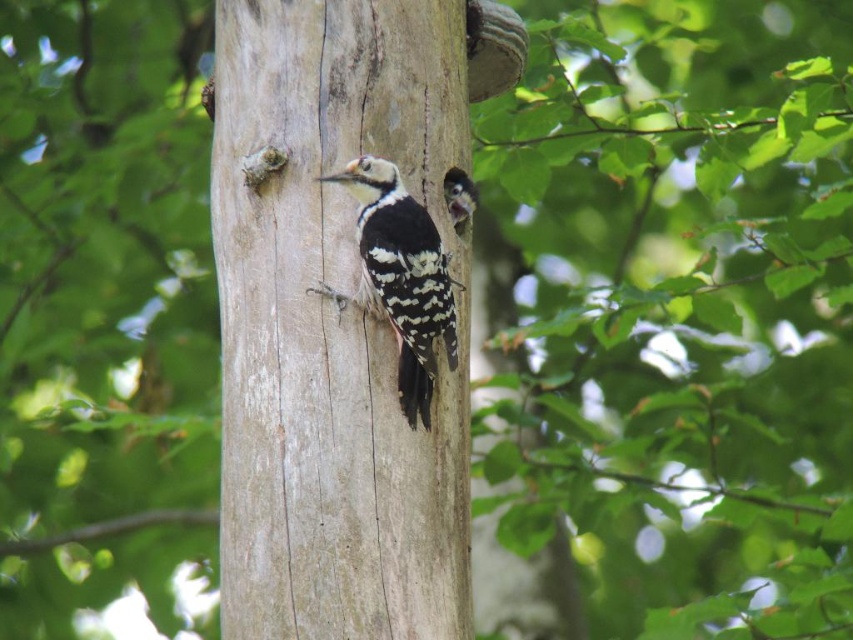
You are a birdwatcher trying to locate the woodpecker in the image. According to the coordinates provided, where exactly is the smooth gray wood at center located?

The smooth gray wood at center is located at coordinates point (332,326).

Based on the photo, you are a photographer aiming to capture a closeup of the smooth gray wood at center. Your camera lens has a minimum focusing distance of 2 meters. Can you get the shot without moving closer than 2 meters?

The smooth gray wood at center is 2.55 meters away from camera, so yes, the photographer can capture the closeup without moving closer than 2 meters since the distance is within the lens minimum focusing range.